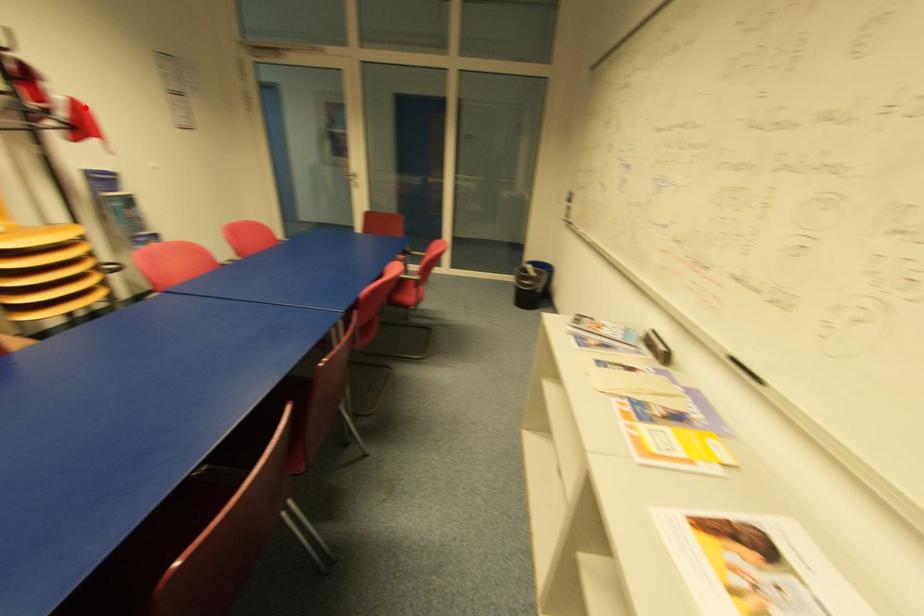
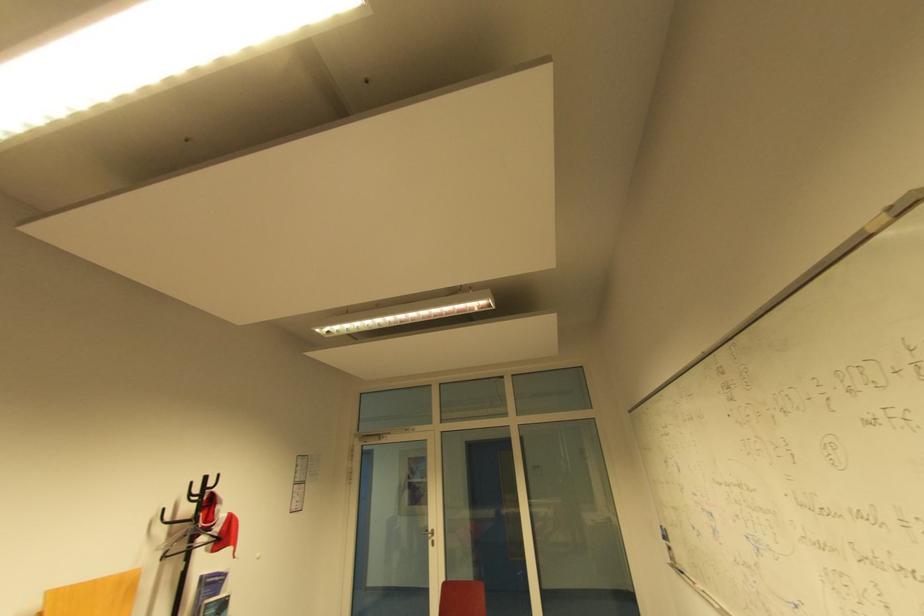
Question: I am providing you with two images of the same scene from different viewpoints. In image1, a red point is highlighted. Considering the same 3D point in image2, which of the following is correct?

Choices:
 (A) It is closer
 (B) It is farther

Answer: (A)